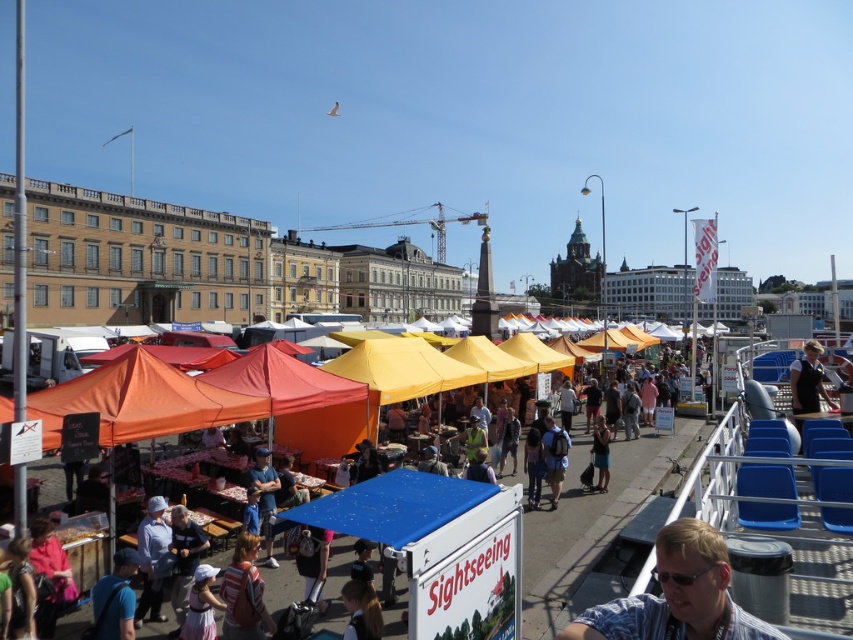
Question: Which point is farther to the camera?

Choices:
 (A) light brown leather backpack at lower center
 (B) blue printed shirt at center
 (C) dark blue uniform at center
 (D) matte blue shorts at center

Answer: (D)

Question: Which point is farther to the camera?

Choices:
 (A) (607, 481)
 (B) (254, 582)
 (C) (379, 604)
 (D) (718, 637)

Answer: (A)

Question: Is dark blue uniform at center thinner than denim jacket at center?

Choices:
 (A) yes
 (B) no

Answer: (B)

Question: Can you confirm if dark blue uniform at center is positioned above matte blue shorts at center?

Choices:
 (A) no
 (B) yes

Answer: (B)

Question: Which object appears farthest from the camera in this image?

Choices:
 (A) denim jacket at center
 (B) light brown hair at lower center
 (C) matte blue shorts at center
 (D) light brown leather backpack at lower center

Answer: (C)

Question: Is dark blue uniform at center above denim jacket at center?

Choices:
 (A) yes
 (B) no

Answer: (A)